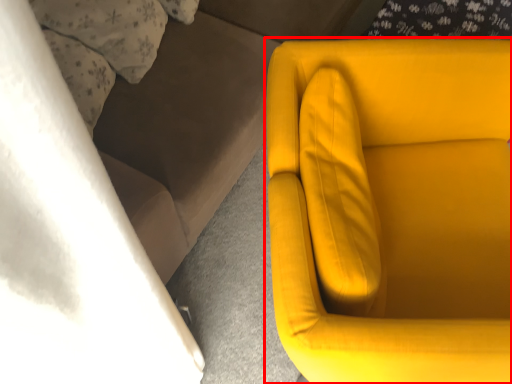
Question: From the image's perspective, where is chair (annotated by the red box) located in relation to couch in the image?

Choices:
 (A) below
 (B) above

Answer: (A)